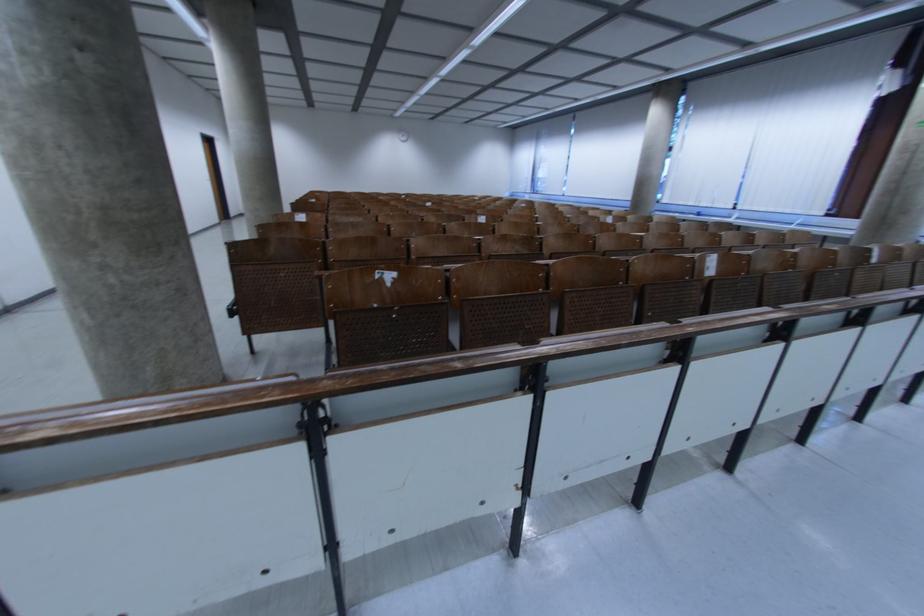
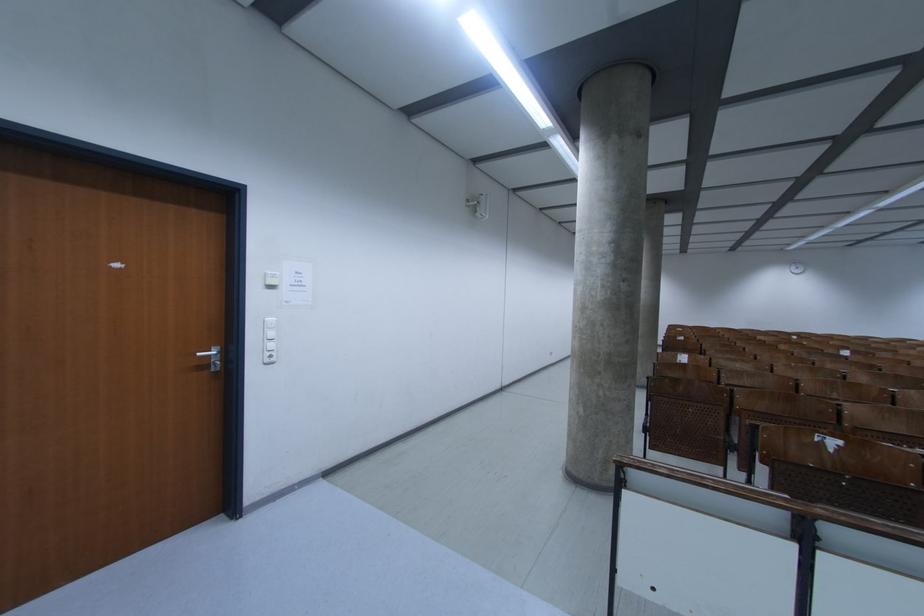
Question: How did the camera likely rotate?

Choices:
 (A) Left
 (B) Right
 (C) Up
 (D) Down

Answer: (A)